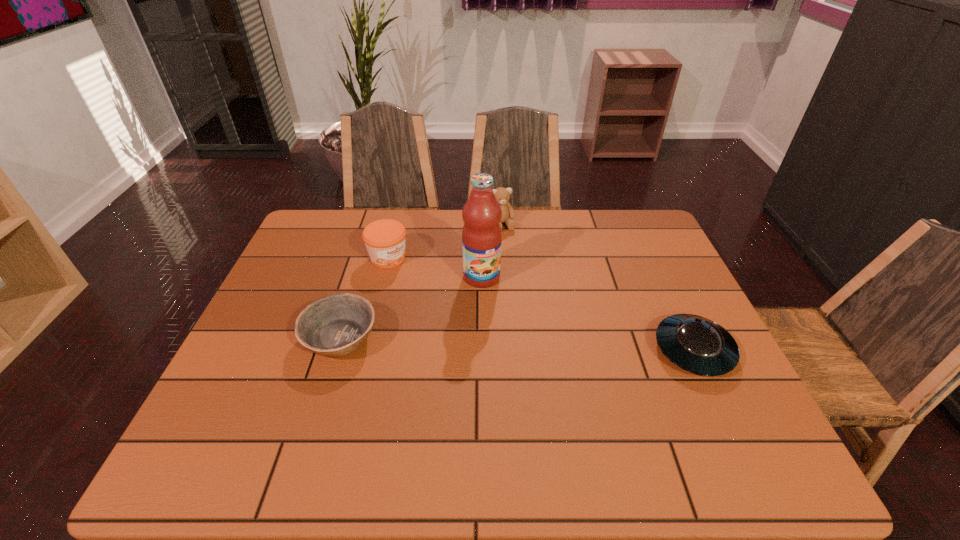
This screenshot has height=540, width=960. In order to click on object located in the right edge section of the desktop in this screenshot , I will do `click(696, 344)`.

You are a GUI agent. You are given a task and a screenshot of the screen. Output one action in this format:
    pyautogui.click(x=<x>, y=<y>)
    Task: Click on the free space at the far edge of the desktop
    
    Given the screenshot: What is the action you would take?
    pyautogui.click(x=544, y=223)

At what (x,y) coordinates should I click in order to perform the action: click on free space at the near edge of the desktop. Please return your answer as a coordinate pair (x, y). Image resolution: width=960 pixels, height=540 pixels. Looking at the image, I should click on (372, 415).

You are a GUI agent. You are given a task and a screenshot of the screen. Output one action in this format:
    pyautogui.click(x=<x>, y=<y>)
    Task: Click on the vacant space at the left edge
    
    Given the screenshot: What is the action you would take?
    pyautogui.click(x=314, y=261)

At what (x,y) coordinates should I click in order to perform the action: click on free space at the right edge of the desktop. Please return your answer as a coordinate pair (x, y). The image size is (960, 540). Looking at the image, I should click on (660, 298).

Where is `free space at the far left corner`? This screenshot has width=960, height=540. free space at the far left corner is located at coordinates (337, 230).

Where is `free space at the near left corner of the desktop`? free space at the near left corner of the desktop is located at coordinates (279, 406).

The width and height of the screenshot is (960, 540). What are the coordinates of `vacant space at the far right corner of the desktop` in the screenshot? It's located at (653, 224).

This screenshot has width=960, height=540. In order to click on blank region between the fruit juice and the saucer in this screenshot , I will do `click(588, 314)`.

You are a GUI agent. You are given a task and a screenshot of the screen. Output one action in this format:
    pyautogui.click(x=<x>, y=<y>)
    Task: Click on the unoccupied area between the saucer and the third tallest object
    This screenshot has width=960, height=540.
    Given the screenshot: What is the action you would take?
    coord(540,304)